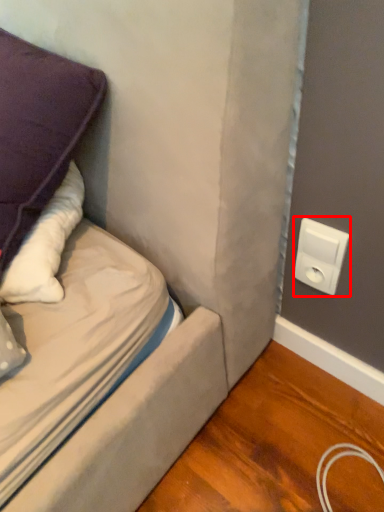
Question: From the image's perspective, where is electric outlet (annotated by the red box) located in relation to pillow in the image?

Choices:
 (A) below
 (B) above

Answer: (A)